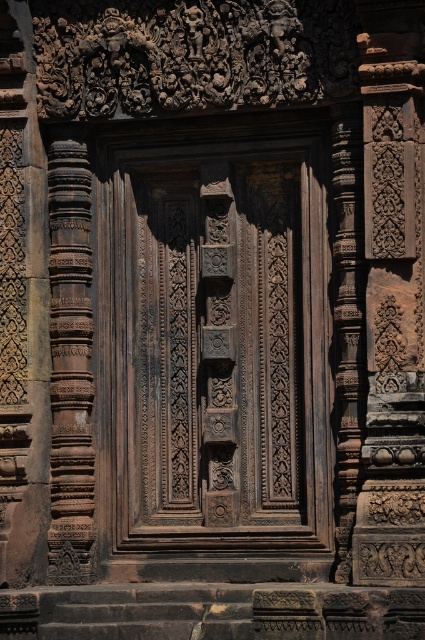
Question: Which object appears closest to the camera in this image?

Choices:
 (A) dark brown wood door at center
 (B) brown carved pillar at left

Answer: (A)

Question: Is dark brown wood door at center positioned at the back of brown carved pillar at left?

Choices:
 (A) no
 (B) yes

Answer: (A)

Question: Can you confirm if dark brown wood door at center is positioned to the right of brown carved pillar at left?

Choices:
 (A) yes
 (B) no

Answer: (A)

Question: Which of the following is the closest to the observer?

Choices:
 (A) (102, 468)
 (B) (62, 435)

Answer: (B)

Question: Which object is closer to the camera taking this photo?

Choices:
 (A) brown carved pillar at left
 (B) dark brown wood door at center

Answer: (B)

Question: Does dark brown wood door at center appear on the right side of brown carved pillar at left?

Choices:
 (A) yes
 (B) no

Answer: (A)